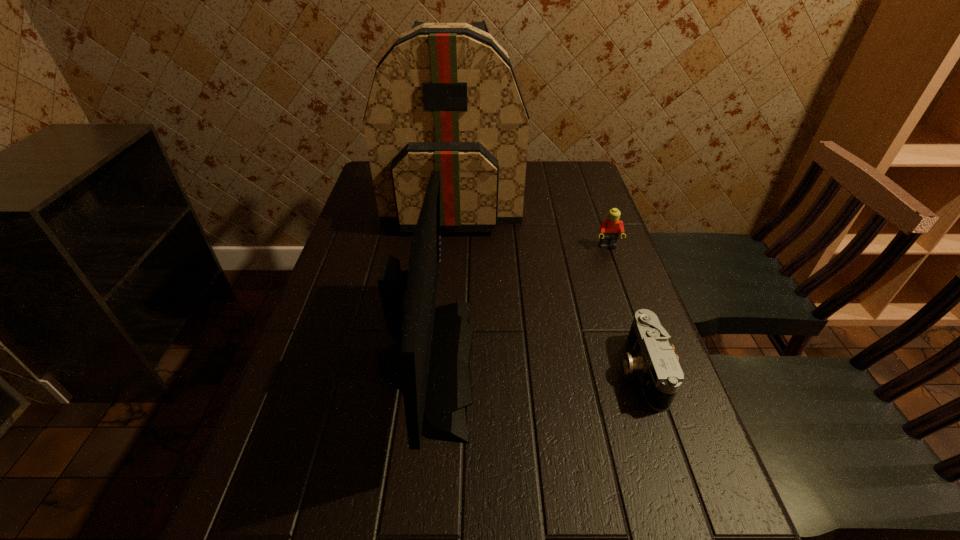
The width and height of the screenshot is (960, 540). Find the location of `the tallest object`. the tallest object is located at coordinates (444, 97).

Where is `backpack`? The height and width of the screenshot is (540, 960). backpack is located at coordinates (444, 97).

Where is `monitor`? monitor is located at coordinates (430, 364).

Identify the location of the third tallest object. The height and width of the screenshot is (540, 960). (610, 228).

You are a GUI agent. You are given a task and a screenshot of the screen. Output one action in this format:
    pyautogui.click(x=<x>, y=<y>)
    Task: Click on the Lego
    The width and height of the screenshot is (960, 540).
    Given the screenshot: What is the action you would take?
    pyautogui.click(x=610, y=228)

Where is `the shortest object`? the shortest object is located at coordinates click(652, 357).

The image size is (960, 540). What are the coordinates of `free space located on the front face of the tallest object` in the screenshot? It's located at click(x=444, y=301).

What are the coordinates of `vacant space situated on the screen side of the monitor` in the screenshot? It's located at (502, 363).

I want to click on blank area located on the face of the second farthest object, so coord(646,353).

This screenshot has width=960, height=540. Find the location of `vacant region located on the lens of the shortest object`. vacant region located on the lens of the shortest object is located at coordinates (511, 370).